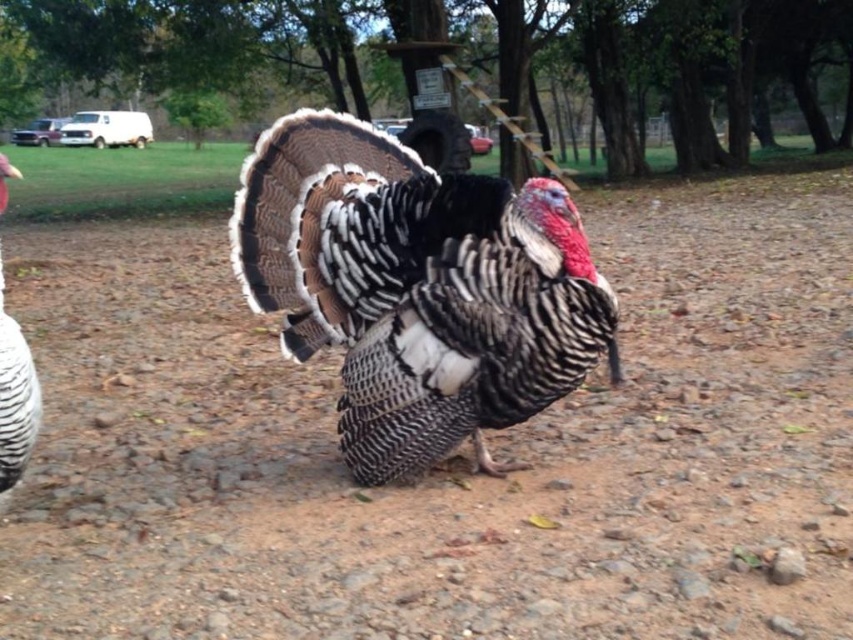
You are standing in a field and want to pick up the brown textured dirt at center and the white feathered turkey at left. Which object is closer to you?

The white feathered turkey at left is closer to you because the brown textured dirt at center is further away.